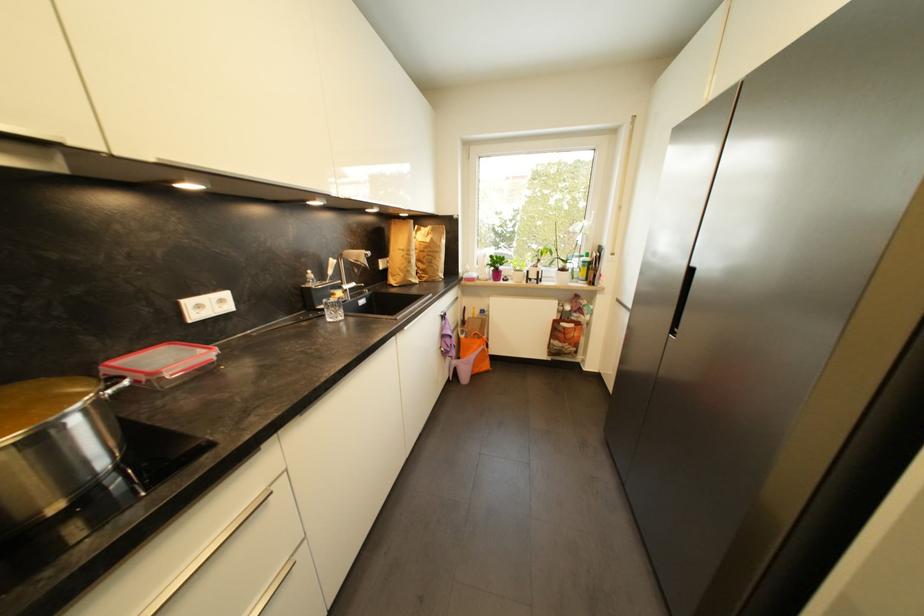
What do you see at coordinates (205, 306) in the screenshot?
I see `the electrical socket` at bounding box center [205, 306].